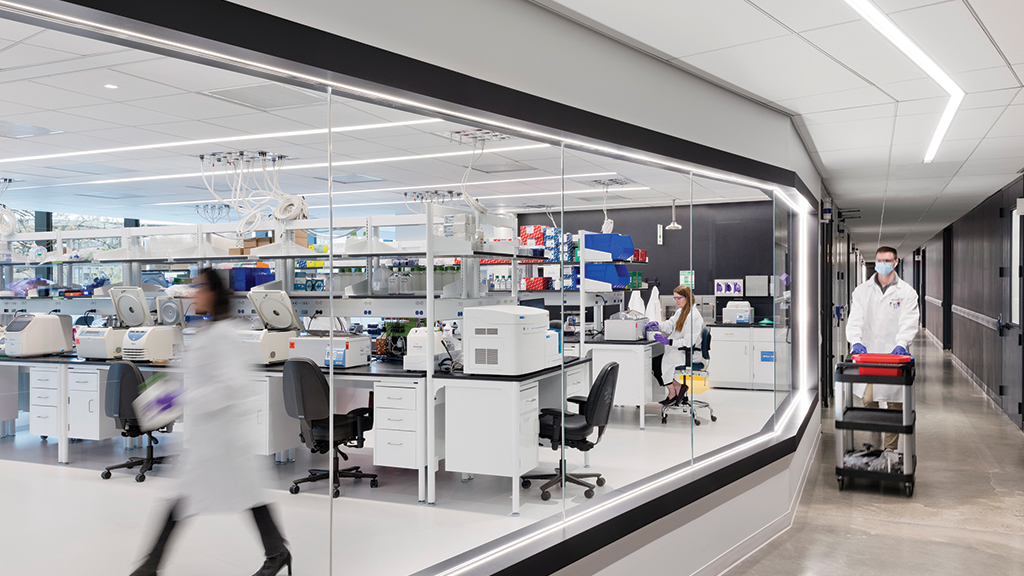
You are a GUI agent. You are given a task and a screenshot of the screen. Output one action in this format:
    pyautogui.click(x=<x>, y=<y>)
    Task: Click on the wires
    
    Given the screenshot: What is the action you would take?
    pyautogui.click(x=273, y=177), pyautogui.click(x=212, y=177)